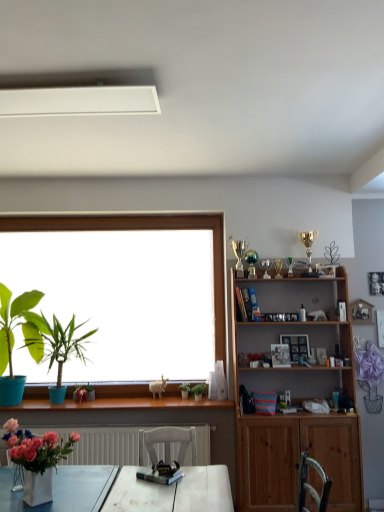
Question: From the image's perspective, does white matte exhaust hood at upper center appear higher than green matte plant at center, marked as the first houseplant in a right-to-left arrangement?

Choices:
 (A) no
 (B) yes

Answer: (B)

Question: Considering the relative sizes of white matte exhaust hood at upper center and green matte plant at center, marked as the first houseplant in a right-to-left arrangement, in the image provided, is white matte exhaust hood at upper center smaller than green matte plant at center, marked as the first houseplant in a right-to-left arrangement,?

Choices:
 (A) yes
 (B) no

Answer: (B)

Question: Is white matte exhaust hood at upper center wider than green matte plant at center, arranged as the 4th houseplant when viewed from the left?

Choices:
 (A) yes
 (B) no

Answer: (A)

Question: Is white matte exhaust hood at upper center thinner than green matte plant at center, marked as the first houseplant in a right-to-left arrangement?

Choices:
 (A) yes
 (B) no

Answer: (B)

Question: Is green matte plant at center, marked as the first houseplant in a right-to-left arrangement, a part of white matte exhaust hood at upper center?

Choices:
 (A) yes
 (B) no

Answer: (B)

Question: Is white matte exhaust hood at upper center looking in the opposite direction of green matte plant at center, marked as the first houseplant in a right-to-left arrangement?

Choices:
 (A) yes
 (B) no

Answer: (B)

Question: Considering the relative sizes of green matte houseplant at center, the second houseplant in the right-to-left sequence, and matte green plant at left, the first houseplant from the left, in the image provided, is green matte houseplant at center, the second houseplant in the right-to-left sequence, taller than matte green plant at left, the first houseplant from the left,?

Choices:
 (A) yes
 (B) no

Answer: (B)

Question: Is green matte houseplant at center, marked as the 3th houseplant in a left-to-right arrangement, positioned behind matte green plant at left, the first houseplant from the left?

Choices:
 (A) yes
 (B) no

Answer: (A)

Question: Is green matte houseplant at center, marked as the 3th houseplant in a left-to-right arrangement, far away from matte green plant at left, which is counted as the fourth houseplant, starting from the right?

Choices:
 (A) no
 (B) yes

Answer: (B)

Question: Does green matte houseplant at center, the second houseplant in the right-to-left sequence, appear on the right side of matte green plant at left, which is counted as the fourth houseplant, starting from the right?

Choices:
 (A) yes
 (B) no

Answer: (A)

Question: Is green matte houseplant at center, the second houseplant in the right-to-left sequence, to the left of matte green plant at left, the first houseplant from the left, from the viewer's perspective?

Choices:
 (A) yes
 (B) no

Answer: (B)

Question: Can you confirm if green matte houseplant at center, marked as the 3th houseplant in a left-to-right arrangement, is bigger than matte green plant at left, the first houseplant from the left?

Choices:
 (A) yes
 (B) no

Answer: (B)

Question: Is wooden shelf at right taller than matte blue pot at left, the 2th houseplant when ordered from left to right?

Choices:
 (A) no
 (B) yes

Answer: (B)